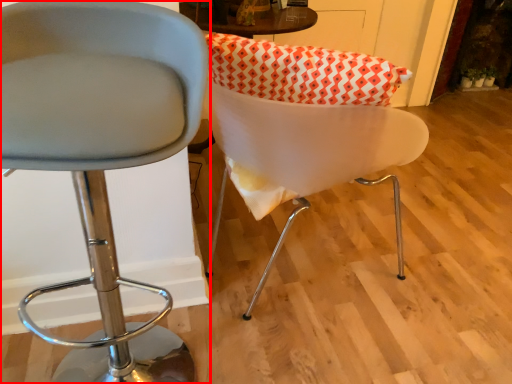
Question: Considering the relative positions of chair (annotated by the red box) and chair in the image provided, where is chair (annotated by the red box) located with respect to the staircase?

Choices:
 (A) right
 (B) left

Answer: (B)